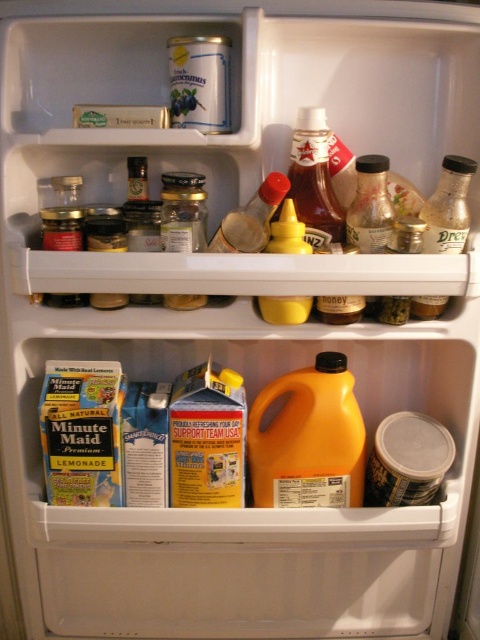
Can you confirm if orange matte plastic jug at center is smaller than matte glass bottle at center?

Incorrect, orange matte plastic jug at center is not smaller in size than matte glass bottle at center.

Consider the image. Can you confirm if orange matte plastic jug at center is thinner than matte glass bottle at center?

Incorrect, orange matte plastic jug at center's width is not less than matte glass bottle at center's.

Between point (357, 467) and point (226, 227), which one is positioned in front?

Point (226, 227)

Locate an element on the screen. This screenshot has width=480, height=640. orange matte plastic jug at center is located at coordinates (309, 440).

Between translucent plastic ketchup bottle at upper center and clear plastic bottle at right, which one is positioned higher?

translucent plastic ketchup bottle at upper center is above.

Is translucent plastic ketchup bottle at upper center below clear plastic bottle at right?

Incorrect, translucent plastic ketchup bottle at upper center is not positioned below clear plastic bottle at right.

Locate an element on the screen. translucent plastic ketchup bottle at upper center is located at coordinates (313, 179).

This screenshot has width=480, height=640. I want to click on translucent plastic ketchup bottle at upper center, so click(x=313, y=179).

Who is shorter, clear glass bottle at upper right or yellow matte mustard at center?

Standing shorter between the two is clear glass bottle at upper right.

You are a GUI agent. You are given a task and a screenshot of the screen. Output one action in this format:
    pyautogui.click(x=<x>, y=<y>)
    Task: Click on the clear glass bottle at upper right
    
    Given the screenshot: What is the action you would take?
    pyautogui.click(x=370, y=205)

The width and height of the screenshot is (480, 640). I want to click on clear glass bottle at upper right, so click(x=370, y=205).

This screenshot has height=640, width=480. I want to click on clear glass bottle at upper right, so click(370, 205).